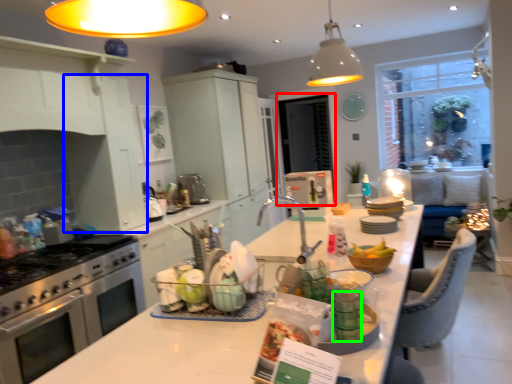
Question: Which object is positioned closest to window screen (highlighted by a red box)? Select from cabinetry (highlighted by a blue box) and tableware (highlighted by a green box).

Choices:
 (A) cabinetry
 (B) tableware

Answer: (A)